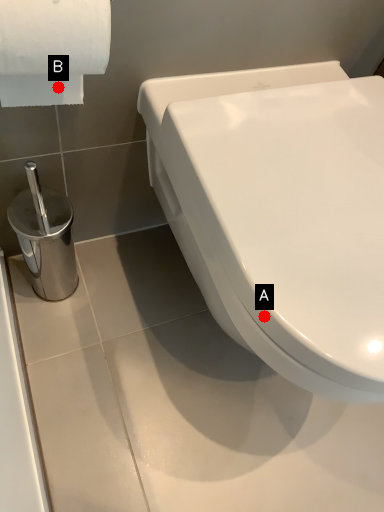
Question: Two points are circled on the image, labeled by A and B beside each circle. Which point is closer to the camera?

Choices:
 (A) A is closer
 (B) B is closer

Answer: (A)